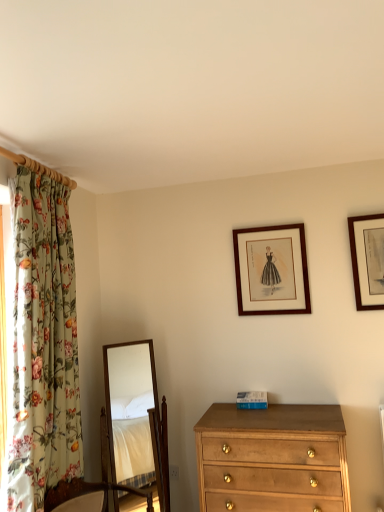
Based on the photo, what is the approximate height of wooden framed print at upper center, the first picture frame positioned from the back?

The height of wooden framed print at upper center, the first picture frame positioned from the back, is 57.15 centimeters.

The height and width of the screenshot is (512, 384). In order to click on floral fabric curtain at left in this screenshot , I will do `click(43, 345)`.

Is wooden framed print at upper center, the 1th picture frame viewed from the left, inside or outside of light brown wood chest of drawers at lower right?

wooden framed print at upper center, the 1th picture frame viewed from the left, is not enclosed by light brown wood chest of drawers at lower right.

What's the angular difference between wooden framed print at upper center, the first picture frame positioned from the back, and light brown wood chest of drawers at lower right's facing directions?

They differ by 0.0696 degrees in their facing directions.

Considering the sizes of objects wooden framed print at upper center, the 1th picture frame viewed from the left, and light brown wood chest of drawers at lower right in the image provided, who is shorter, wooden framed print at upper center, the 1th picture frame viewed from the left, or light brown wood chest of drawers at lower right?

With less height is wooden framed print at upper center, the 1th picture frame viewed from the left.

Can you confirm if floral fabric curtain at left is wider than wooden framed print at upper center, the 1th picture frame viewed from the left?

Indeed, floral fabric curtain at left has a greater width compared to wooden framed print at upper center, the 1th picture frame viewed from the left.

From the image's perspective, between floral fabric curtain at left and wooden framed print at upper center, the first picture frame positioned from the back, which one is located above?

wooden framed print at upper center, the first picture frame positioned from the back, from the image's perspective.

Do you think floral fabric curtain at left is within wooden framed print at upper center, which is the 2th picture frame from right to left, or outside of it?

floral fabric curtain at left is spatially situated outside wooden framed print at upper center, which is the 2th picture frame from right to left.

Does floral fabric curtain at left touch wooden framed print at upper center, which is the 2th picture frame from right to left?

No, floral fabric curtain at left is not next to wooden framed print at upper center, which is the 2th picture frame from right to left.

From a real-world perspective, which is physically above, wooden mirror at center or floral fabric curtain at left?

floral fabric curtain at left is physically above.

Is wooden mirror at center far away from floral fabric curtain at left?

wooden mirror at center is positioned a significant distance from floral fabric curtain at left.

Between wooden mirror at center and floral fabric curtain at left, which one has larger width?

wooden mirror at center.

Locate an element on the screen. The width and height of the screenshot is (384, 512). curtain to the left of wooden mirror at center is located at coordinates (43, 345).

Is wooden framed print at upper center, acting as the second picture frame starting from the front, positioned with its back to floral fabric curtain at left?

No, floral fabric curtain at left is not at the back of wooden framed print at upper center, acting as the second picture frame starting from the front.

Considering the sizes of objects wooden framed print at upper center, acting as the second picture frame starting from the front, and floral fabric curtain at left in the image provided, who is shorter, wooden framed print at upper center, acting as the second picture frame starting from the front, or floral fabric curtain at left?

With less height is wooden framed print at upper center, acting as the second picture frame starting from the front.

Would you say floral fabric curtain at left is part of wooden framed print at upper center, the first picture frame positioned from the back,'s contents?

No, wooden framed print at upper center, the first picture frame positioned from the back, does not contain floral fabric curtain at left.

What's the angular difference between wooden framed print at upper center, acting as the second picture frame starting from the front, and floral fabric curtain at left's facing directions?

They differ by 95.1 degrees in their facing directions.

Consider the image. Which is more distant, (241, 259) or (157, 470)?

The point (241, 259) is more distant.

Consider the image. Between wooden framed print at upper center, which is the 2th picture frame from right to left, and wooden mirror at center, which one has larger size?

wooden mirror at center is bigger.

Would you say wooden framed print at upper center, which is the 2th picture frame from right to left, contains wooden mirror at center?

No, wooden mirror at center is not a part of wooden framed print at upper center, which is the 2th picture frame from right to left.

From the image's perspective, is wooden framed print at upper center, the first picture frame positioned from the back, above or below wooden mirror at center?

wooden framed print at upper center, the first picture frame positioned from the back, is situated higher than wooden mirror at center in the image.

Is floral fabric curtain at left far from wooden picture frame at upper right, marked as the first picture frame in a right-to-left arrangement?

Yes, floral fabric curtain at left and wooden picture frame at upper right, marked as the first picture frame in a right-to-left arrangement, are quite far apart.

Does floral fabric curtain at left appear on the right side of wooden picture frame at upper right, which is the second picture frame from left to right?

No.

At what (x,y) coordinates should I click in order to perform the action: click on picture frame that is the 2nd one when counting rightward from the floral fabric curtain at left. Please return your answer as a coordinate pair (x, y). The height and width of the screenshot is (512, 384). Looking at the image, I should click on (367, 260).

How far apart are floral fabric curtain at left and wooden picture frame at upper right, which is the second picture frame from left to right?

floral fabric curtain at left and wooden picture frame at upper right, which is the second picture frame from left to right, are 1.73 meters apart.

Between wooden framed print at upper center, which is the 2th picture frame from right to left, and wooden picture frame at upper right, which is the second picture frame from left to right, which one has smaller size?

Smaller between the two is wooden picture frame at upper right, which is the second picture frame from left to right.

From the image's perspective, between wooden framed print at upper center, the first picture frame positioned from the back, and wooden picture frame at upper right, which is the second picture frame from left to right, which one is located above?

wooden picture frame at upper right, which is the second picture frame from left to right, from the image's perspective.

Considering the relative positions of wooden framed print at upper center, which is the 2th picture frame from right to left, and wooden picture frame at upper right, which ranks as the 1th picture frame in front-to-back order, in the image provided, is wooden framed print at upper center, which is the 2th picture frame from right to left, to the left of wooden picture frame at upper right, which ranks as the 1th picture frame in front-to-back order, from the viewer's perspective?

Yes.

Can wooden picture frame at upper right, which ranks as the 1th picture frame in front-to-back order, be found inside wooden framed print at upper center, acting as the second picture frame starting from the front?

No, wooden picture frame at upper right, which ranks as the 1th picture frame in front-to-back order, is not inside wooden framed print at upper center, acting as the second picture frame starting from the front.

This screenshot has height=512, width=384. I want to click on the chest of drawers located below the wooden framed print at upper center, acting as the second picture frame starting from the front (from the image's perspective), so click(272, 459).

From the image's perspective, count 1st picture frames upward from the floral fabric curtain at left and point to it. Please provide its 2D coordinates.

[(271, 270)]

Estimate the real-world distances between objects in this image. Which object is closer to wooden picture frame at upper right, which is the second picture frame from left to right, floral fabric curtain at left or wooden framed print at upper center, acting as the second picture frame starting from the front?

wooden framed print at upper center, acting as the second picture frame starting from the front.

Based on their spatial positions, is wooden mirror at center or wooden framed print at upper center, which is the 2th picture frame from right to left, closer to light brown wood chest of drawers at lower right?

wooden framed print at upper center, which is the 2th picture frame from right to left.

From the image, which object appears to be farther from wooden mirror at center, wooden framed print at upper center, which is the 2th picture frame from right to left, or floral fabric curtain at left?

Among the two, floral fabric curtain at left is located further to wooden mirror at center.

Based on their spatial positions, is wooden mirror at center or light brown wood chest of drawers at lower right further from floral fabric curtain at left?

The object further to floral fabric curtain at left is wooden mirror at center.

Based on their spatial positions, is wooden picture frame at upper right, which is the second picture frame from left to right, or wooden framed print at upper center, the first picture frame positioned from the back, closer to wooden mirror at center?

wooden framed print at upper center, the first picture frame positioned from the back, lies closer to wooden mirror at center than the other object.

Considering their positions, is light brown wood chest of drawers at lower right positioned closer to wooden framed print at upper center, which is the 2th picture frame from right to left, than floral fabric curtain at left?

Among the two, light brown wood chest of drawers at lower right is located nearer to wooden framed print at upper center, which is the 2th picture frame from right to left.

Which object lies further to the anchor point wooden mirror at center, wooden framed print at upper center, the first picture frame positioned from the back, or wooden picture frame at upper right, marked as the first picture frame in a right-to-left arrangement?

wooden picture frame at upper right, marked as the first picture frame in a right-to-left arrangement, is positioned further to the anchor wooden mirror at center.

When comparing their distances from wooden mirror at center, does floral fabric curtain at left or light brown wood chest of drawers at lower right seem closer?

The object closer to wooden mirror at center is light brown wood chest of drawers at lower right.

Find the location of a particular element. picture frame between wooden picture frame at upper right, which is the second picture frame from left to right, and light brown wood chest of drawers at lower right vertically is located at coordinates 271,270.

Where is `mirror situated between floral fabric curtain at left and light brown wood chest of drawers at lower right from left to right`? mirror situated between floral fabric curtain at left and light brown wood chest of drawers at lower right from left to right is located at coordinates (136, 419).

What are the coordinates of `mirror between floral fabric curtain at left and wooden picture frame at upper right, the 2th picture frame viewed from the back, in the horizontal direction` in the screenshot? It's located at (136, 419).

Find the location of a particular element. This screenshot has width=384, height=512. picture frame between floral fabric curtain at left and wooden picture frame at upper right, which is the second picture frame from left to right is located at coordinates (271, 270).